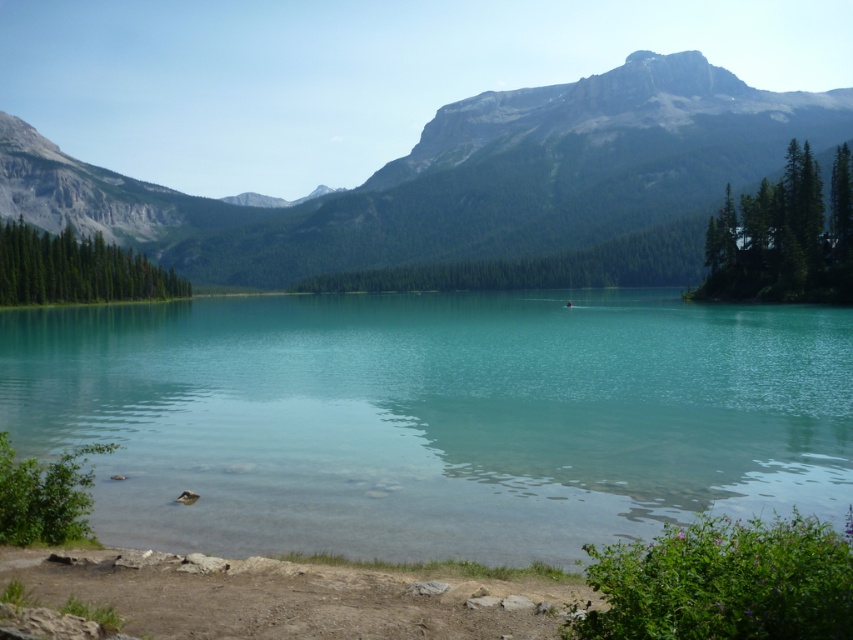
Question: Which object is farther from the camera taking this photo?

Choices:
 (A) clear glass water at center
 (B) green rock mountain at upper center
 (C) dull brown dirt at lower center

Answer: (B)

Question: Which is nearer to the dull brown dirt at lower center?

Choices:
 (A) clear glass water at center
 (B) green rock mountain at upper center

Answer: (A)

Question: Which point is closer to the camera?

Choices:
 (A) (173, 593)
 (B) (508, 529)
 (C) (451, 156)

Answer: (A)

Question: Is clear glass water at center behind dull brown dirt at lower center?

Choices:
 (A) no
 (B) yes

Answer: (B)

Question: Is green rock mountain at upper center to the left of dull brown dirt at lower center from the viewer's perspective?

Choices:
 (A) no
 (B) yes

Answer: (B)

Question: Is clear glass water at center thinner than green rock mountain at upper center?

Choices:
 (A) yes
 (B) no

Answer: (A)